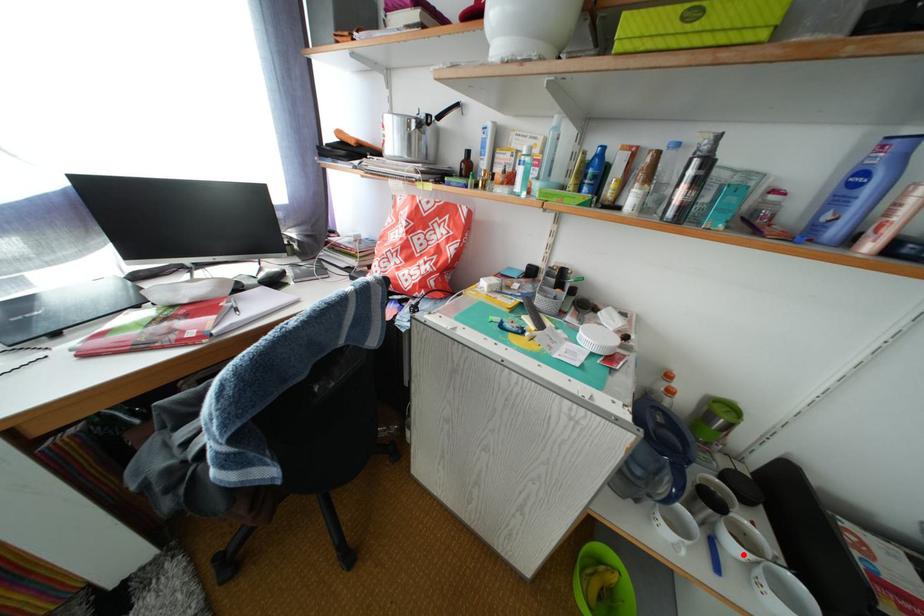
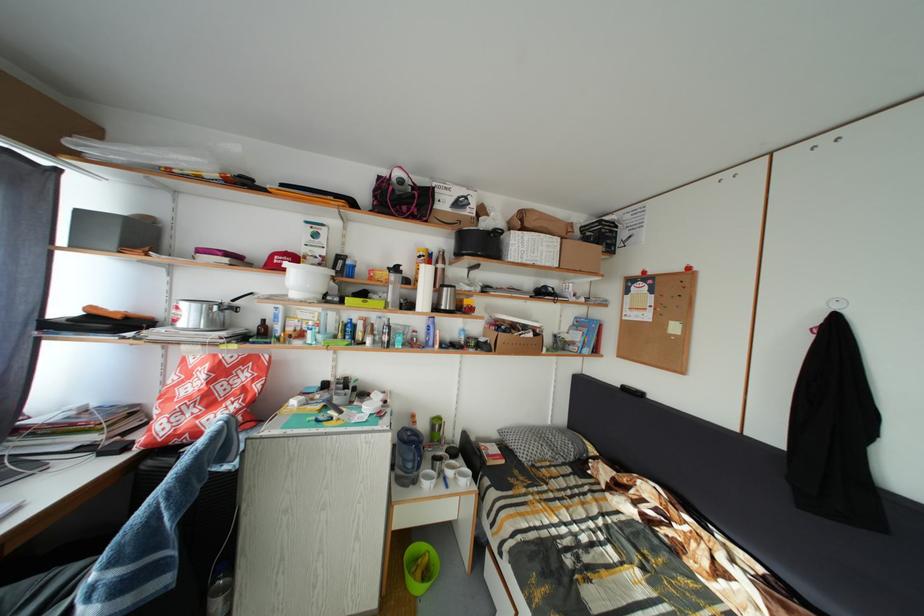
In the second image, find the point that corresponds to the highlighted location in the first image.

(458, 480)